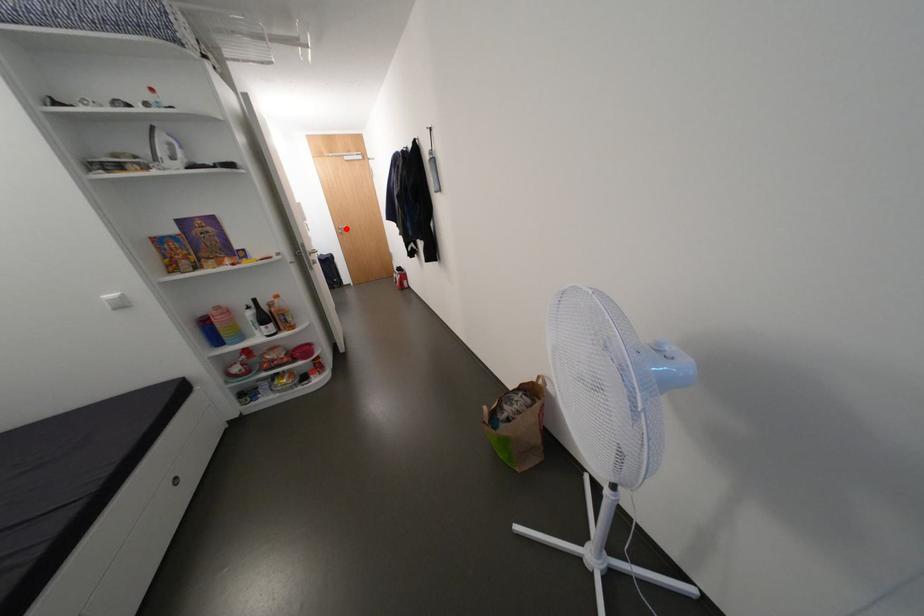
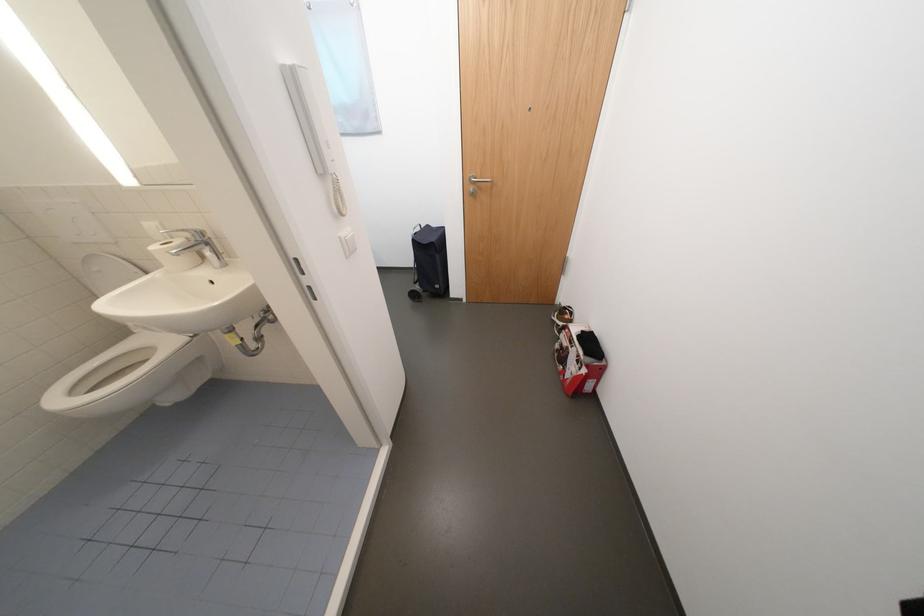
Question: I am providing you with two images of the same scene from different viewpoints. Given a red point in image1, look at the same physical point in image2. Is it:

Choices:
 (A) Closer to the viewpoint
 (B) Farther from the viewpoint

Answer: (B)